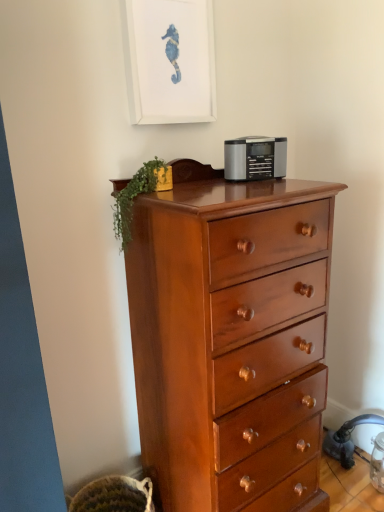
Question: From a real-world perspective, is green leafy plant at upper left physically below shiny brown wooden chest of drawers at center?

Choices:
 (A) no
 (B) yes

Answer: (A)

Question: Is the depth of green leafy plant at upper left greater than that of shiny brown wooden chest of drawers at center?

Choices:
 (A) no
 (B) yes

Answer: (B)

Question: Is green leafy plant at upper left smaller than shiny brown wooden chest of drawers at center?

Choices:
 (A) yes
 (B) no

Answer: (A)

Question: Does green leafy plant at upper left lie in front of shiny brown wooden chest of drawers at center?

Choices:
 (A) yes
 (B) no

Answer: (B)

Question: Does green leafy plant at upper left have a lesser width compared to shiny brown wooden chest of drawers at center?

Choices:
 (A) yes
 (B) no

Answer: (A)

Question: Looking at their shapes, would you say green leafy plant at upper left is wider or thinner than shiny brown wooden chest of drawers at center?

Choices:
 (A) thin
 (B) wide

Answer: (A)

Question: In the image, is green leafy plant at upper left on the left side or the right side of shiny brown wooden chest of drawers at center?

Choices:
 (A) left
 (B) right

Answer: (A)

Question: From the image's perspective, is green leafy plant at upper left above or below shiny brown wooden chest of drawers at center?

Choices:
 (A) above
 (B) below

Answer: (A)

Question: Does point (160, 160) appear closer or farther from the camera than point (314, 336)?

Choices:
 (A) closer
 (B) farther

Answer: (B)

Question: Considering the positions of point (190, 12) and point (196, 352), is point (190, 12) closer or farther from the camera than point (196, 352)?

Choices:
 (A) farther
 (B) closer

Answer: (A)

Question: In terms of width, does white matte picture frame at upper center look wider or thinner when compared to shiny brown wooden chest of drawers at center?

Choices:
 (A) wide
 (B) thin

Answer: (B)

Question: Considering the positions of white matte picture frame at upper center and shiny brown wooden chest of drawers at center in the image, is white matte picture frame at upper center taller or shorter than shiny brown wooden chest of drawers at center?

Choices:
 (A) short
 (B) tall

Answer: (A)

Question: From a real-world perspective, is white matte picture frame at upper center positioned above or below shiny brown wooden chest of drawers at center?

Choices:
 (A) below
 (B) above

Answer: (B)

Question: From the image's perspective, is satin silver radio at center located above or below shiny brown wooden chest of drawers at center?

Choices:
 (A) below
 (B) above

Answer: (B)

Question: In terms of size, does satin silver radio at center appear bigger or smaller than shiny brown wooden chest of drawers at center?

Choices:
 (A) big
 (B) small

Answer: (B)